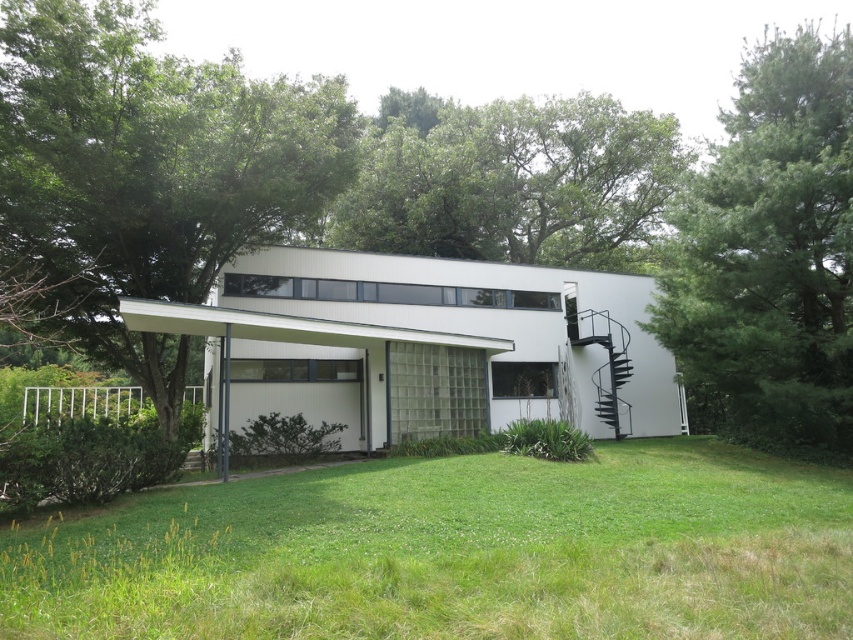
Based on the photo, does green leafy tree at upper left have a greater height compared to green leafy tree at center?

In fact, green leafy tree at upper left may be shorter than green leafy tree at center.

Is point (106, 212) in front of point (500, 211)?

Yes, point (106, 212) is in front of point (500, 211).

Where is `green leafy tree at upper left`? This screenshot has width=853, height=640. green leafy tree at upper left is located at coordinates (149, 170).

Is point (766, 595) farther from viewer compared to point (822, 385)?

No, (766, 595) is closer to viewer.

Between point (354, 472) and point (757, 385), which one is positioned in front?

Point (354, 472)

Where is `green grass at lower center`? green grass at lower center is located at coordinates (454, 552).

Can you confirm if green leafy tree at right is shorter than green leafy tree at center?

Incorrect, green leafy tree at right's height does not fall short of green leafy tree at center's.

Between green leafy tree at right and green leafy tree at center, which one is positioned higher?

Positioned higher is green leafy tree at right.

The height and width of the screenshot is (640, 853). What do you see at coordinates (770, 248) in the screenshot?
I see `green leafy tree at right` at bounding box center [770, 248].

This screenshot has width=853, height=640. What are the coordinates of `green leafy tree at right` in the screenshot? It's located at (770, 248).